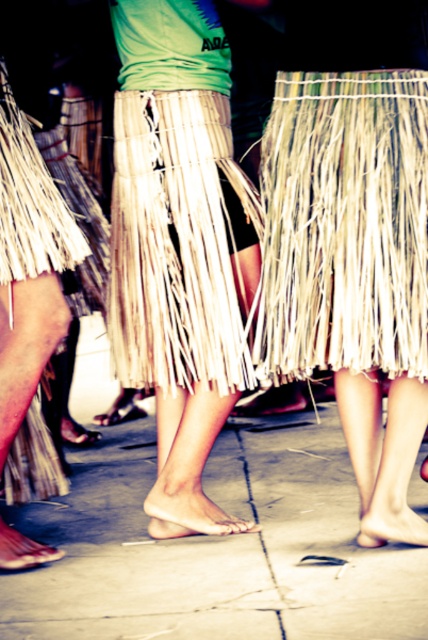
Is concrete at center below natural fiber skirt at center?

Yes, concrete at center is below natural fiber skirt at center.

The height and width of the screenshot is (640, 428). Find the location of `concrete at center`. concrete at center is located at coordinates (216, 548).

What do you see at coordinates (216, 548) in the screenshot? Image resolution: width=428 pixels, height=640 pixels. I see `concrete at center` at bounding box center [216, 548].

Where is `concrete at center`? The width and height of the screenshot is (428, 640). concrete at center is located at coordinates (216, 548).